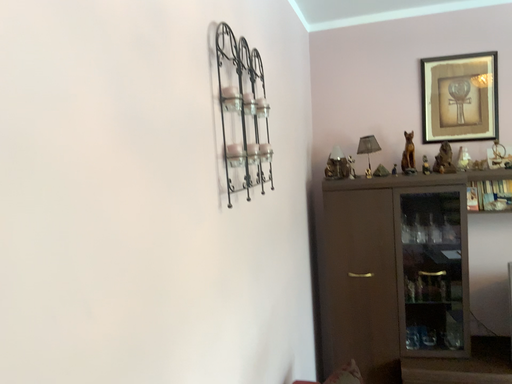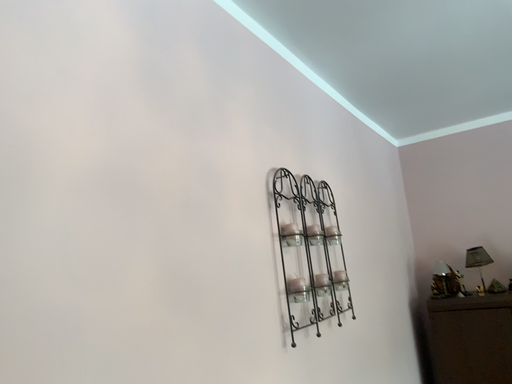
Question: Which way did the camera rotate in the video?

Choices:
 (A) rotated downward
 (B) rotated upward

Answer: (B)